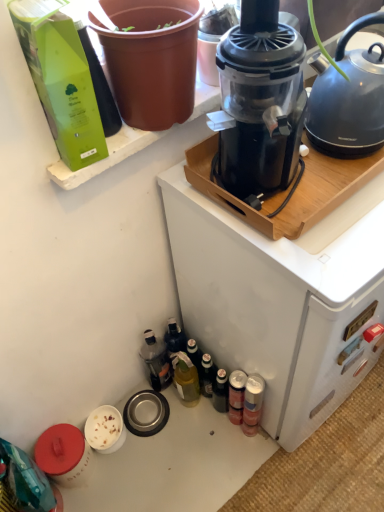
Where is `space that is in front of metallic silver can at lower right, which ranks as the third bottle in left-to-right order`? This screenshot has width=384, height=512. space that is in front of metallic silver can at lower right, which ranks as the third bottle in left-to-right order is located at coordinates (246, 470).